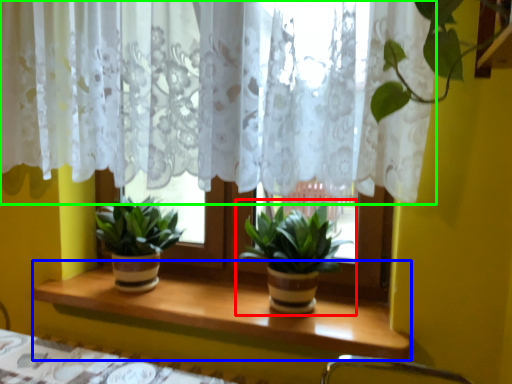
Question: Estimate the real-world distances between objects in this image. Which object is closer to houseplant (highlighted by a red box), window sill (highlighted by a blue box) or curtain (highlighted by a green box)?

Choices:
 (A) window sill
 (B) curtain

Answer: (A)